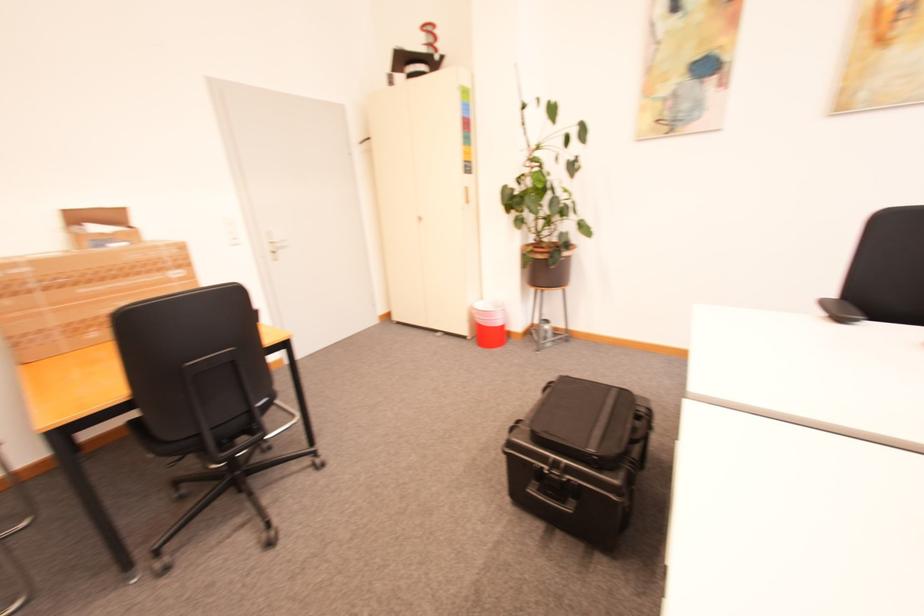
Describe the element at coordinates (553, 496) in the screenshot. I see `the black case handle` at that location.